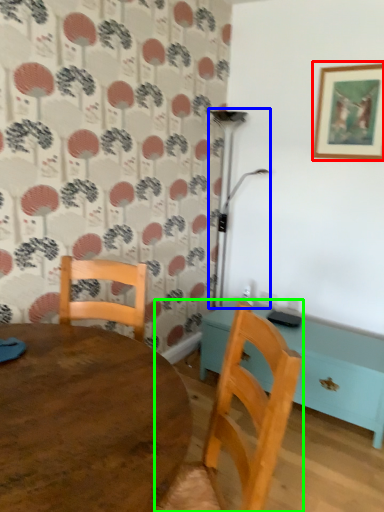
Question: Which object is positioned closest to picture frame (highlighted by a red box)? Select from lamp (highlighted by a blue box) and chair (highlighted by a green box).

Choices:
 (A) lamp
 (B) chair

Answer: (A)